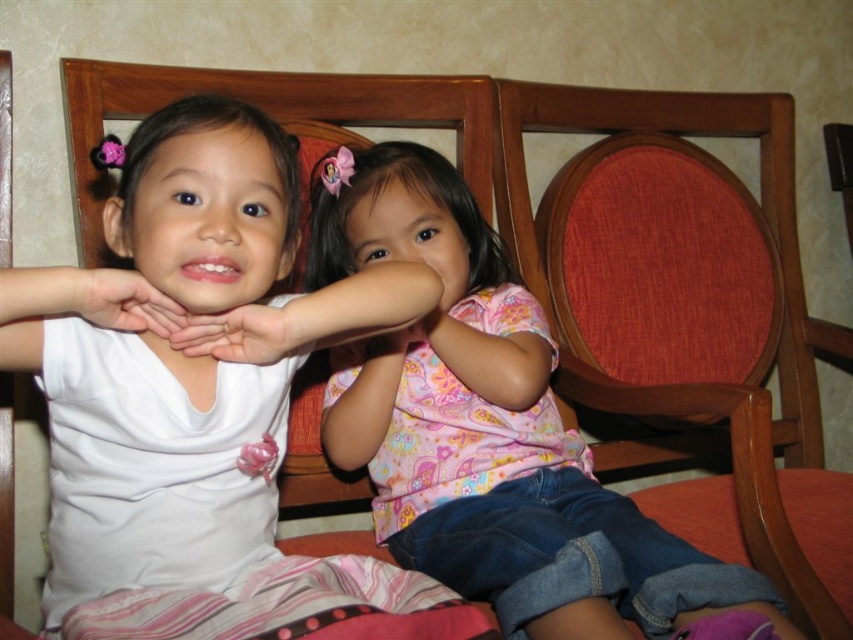
Question: From the image, what is the correct spatial relationship of white matte shirt at left in relation to matte white hand at center?

Choices:
 (A) below
 (B) above

Answer: (A)

Question: Which point is farther to the camera?

Choices:
 (A) (421, 317)
 (B) (352, 420)
 (C) (271, 499)
 (D) (183, 324)

Answer: (B)

Question: Which object is positioned farthest from the matte pink fabric at center?

Choices:
 (A) white matte shirt at left
 (B) matte white hands at center
 (C) matte white hand at center

Answer: (C)

Question: Can you confirm if white matte shirt at left is positioned below matte white hands at center?

Choices:
 (A) yes
 (B) no

Answer: (A)

Question: Can you confirm if white matte shirt at left is positioned to the right of matte white hand at center?

Choices:
 (A) no
 (B) yes

Answer: (B)

Question: Among these points, which one is nearest to the camera?

Choices:
 (A) (187, 328)
 (B) (404, 320)
 (C) (190, 330)
 (D) (323, 202)

Answer: (C)